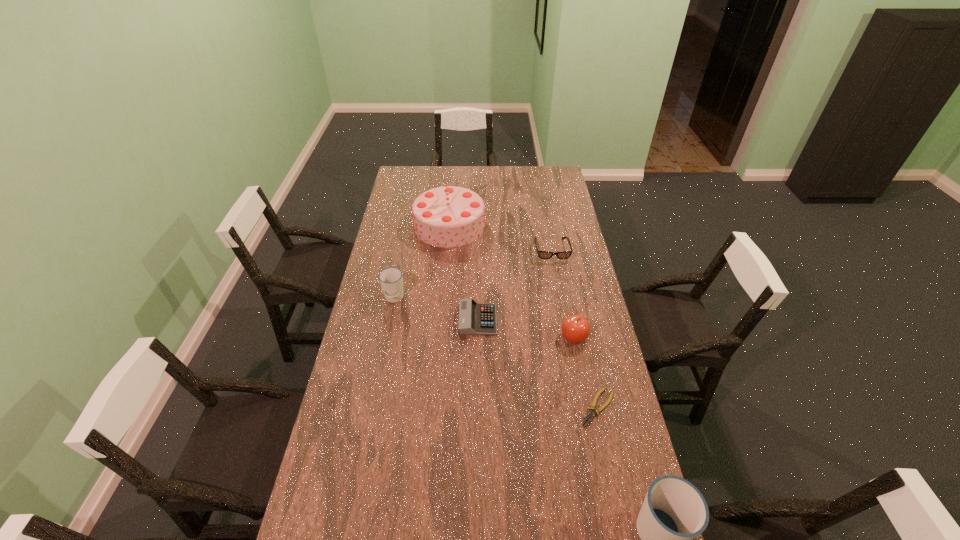
Find the location of a particular element. free space located 0.070m on the lenses of the third shortest object is located at coordinates (556, 274).

Locate an element on the screen. free spot located 0.310m on the front of the apple is located at coordinates (592, 429).

Find the location of `vacant region located 0.160m on the left of the shortest object`. vacant region located 0.160m on the left of the shortest object is located at coordinates (529, 408).

Locate an element on the screen. The height and width of the screenshot is (540, 960). vacant area located on the front of the sixth tallest object is located at coordinates (477, 346).

At what (x,y) coordinates should I click in order to perform the action: click on cup present at the left edge. Please return your answer as a coordinate pair (x, y). Image resolution: width=960 pixels, height=540 pixels. Looking at the image, I should click on (391, 279).

Find the location of a particular element. This screenshot has width=960, height=540. birthday cake that is positioned at the left edge is located at coordinates (449, 216).

At what (x,y) coordinates should I click in order to perform the action: click on spectacles that is at the right edge. Please return your answer as a coordinate pair (x, y). Image resolution: width=960 pixels, height=540 pixels. Looking at the image, I should click on (541, 254).

Find the location of a particular element. apple that is positioned at the right edge is located at coordinates (575, 328).

Identify the location of pliers present at the right edge. (591, 414).

In the image, there is a desktop. Where is `blank space at the far edge`? blank space at the far edge is located at coordinates (468, 174).